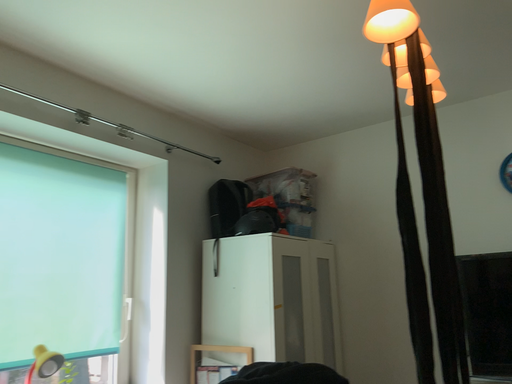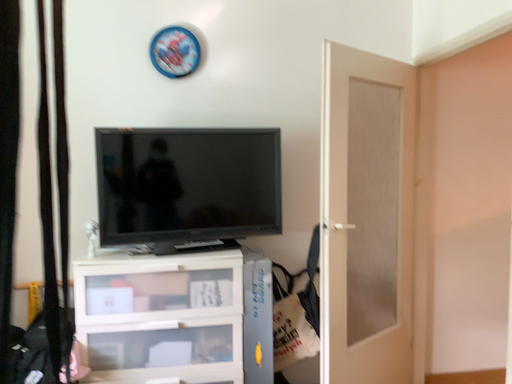
Question: Which way did the camera rotate in the video?

Choices:
 (A) rotated left
 (B) rotated right

Answer: (B)